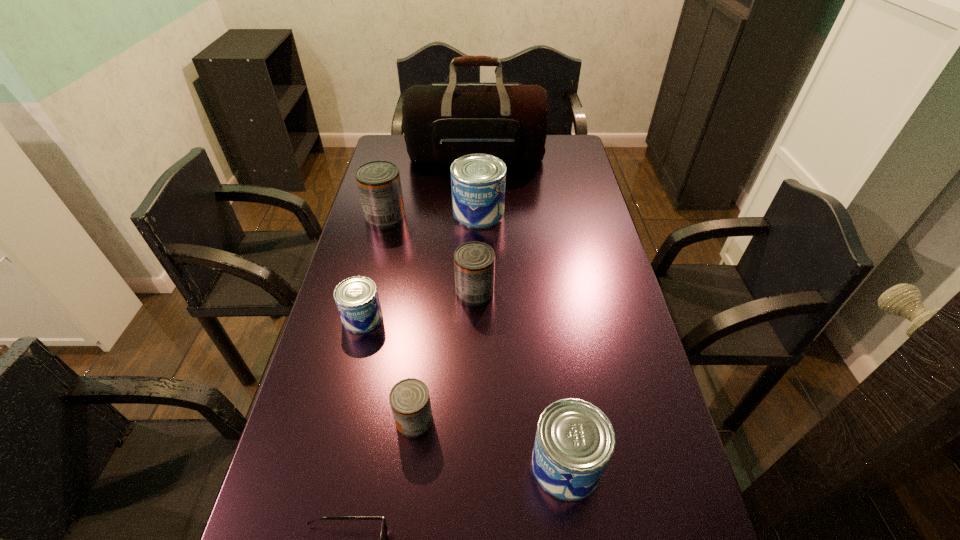
Identify the location of can that stands as the third closest to the farthest red can. (357, 300).

Point out which can is positioned as the nearest to the leftmost red can. Please provide its 2D coordinates. Your answer should be formatted as a tuple, i.e. [(x, y)], where the tuple contains the x and y coordinates of a point satisfying the conditions above.

[(478, 181)]

Find the location of a particular element. the third closest red can to the red duffel bag is located at coordinates (409, 399).

Where is `red can that is the closest one to the nearest red can`? This screenshot has height=540, width=960. red can that is the closest one to the nearest red can is located at coordinates (474, 262).

Identify the location of blue can that stands as the third closest to the third can from left to right. (478, 181).

Select which blue can appears as the closest to the leftmost blue can. Please provide its 2D coordinates. Your answer should be formatted as a tuple, i.e. [(x, y)], where the tuple contains the x and y coordinates of a point satisfying the conditions above.

[(478, 181)]

Where is `free spot that satisfies the following two spatial constraints: 1. on the front label of the second nearest blue can; 2. on the right side of the nearest red can`? free spot that satisfies the following two spatial constraints: 1. on the front label of the second nearest blue can; 2. on the right side of the nearest red can is located at coordinates (337, 421).